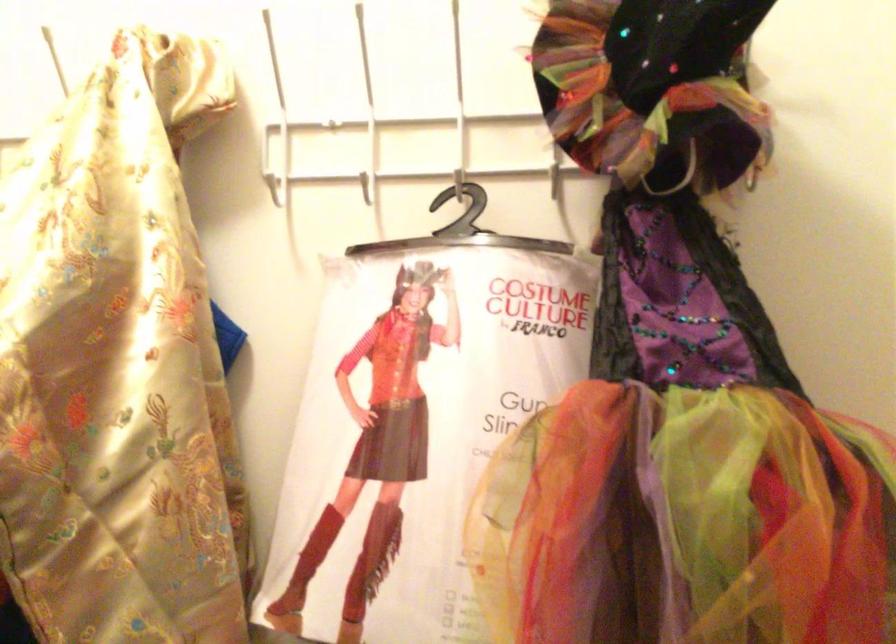
The height and width of the screenshot is (644, 896). Describe the element at coordinates (461, 230) in the screenshot. I see `the black hanger hook` at that location.